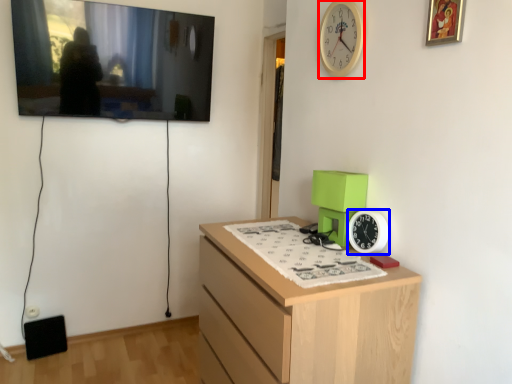
Question: Which point is closer to the camera, clock (highlighted by a red box) or clock (highlighted by a blue box)?

Choices:
 (A) clock
 (B) clock

Answer: (B)